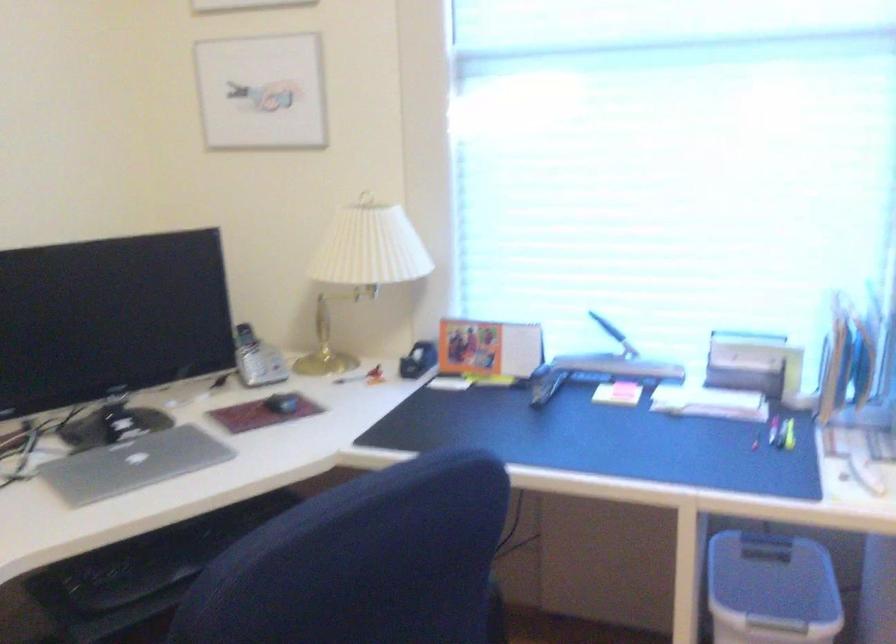
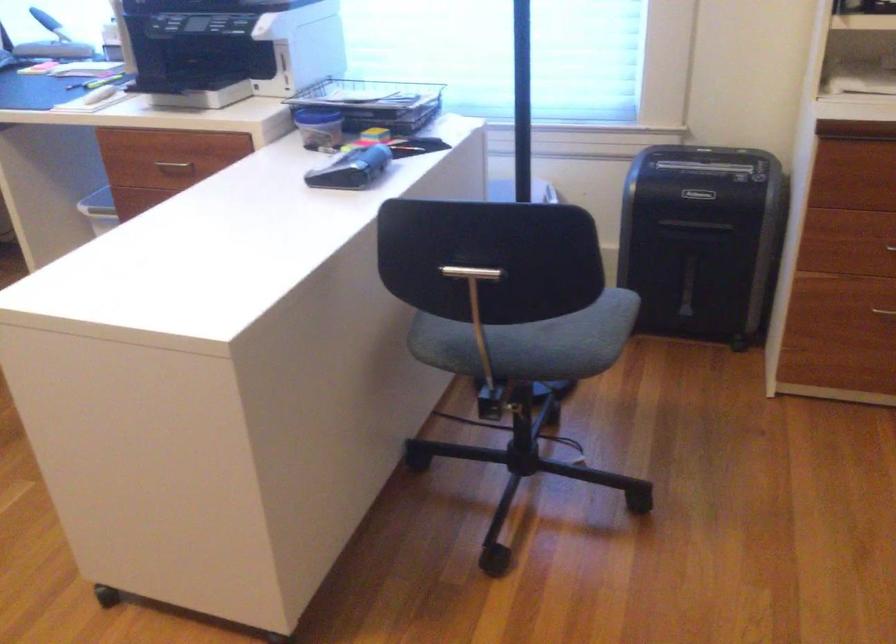
Question: I am providing you with two images of the same scene from different viewpoints. After the viewpoint changes to image2, which objects are now occluded?

Choices:
 (A) chair sitting surface
 (B) white tape
 (C) metal T-handle
 (D) storage bin lid

Answer: (D)